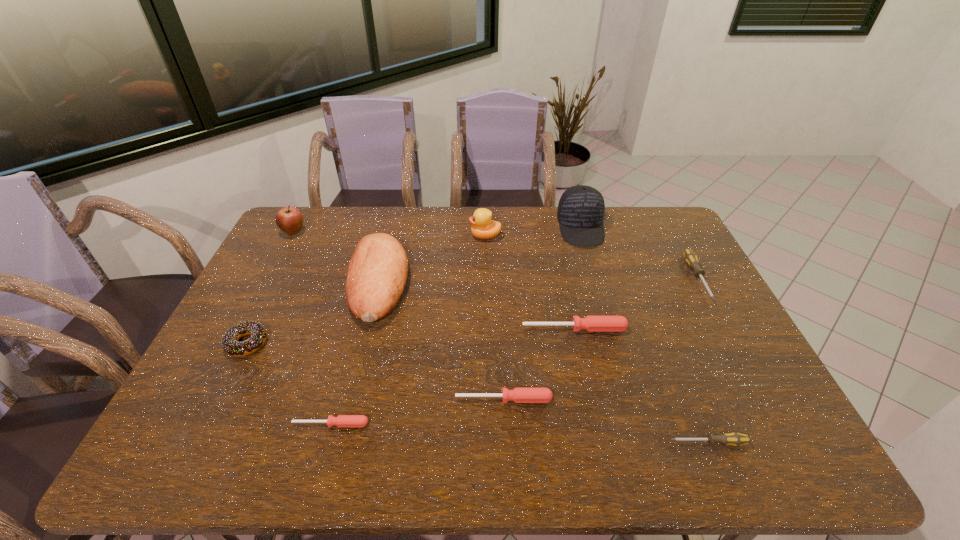
You are a GUI agent. You are given a task and a screenshot of the screen. Output one action in this format:
    pyautogui.click(x=<x>, y=<y>)
    Task: Click on the tallest object
    
    Given the screenshot: What is the action you would take?
    pyautogui.click(x=580, y=214)

The width and height of the screenshot is (960, 540). In order to click on red apple in this screenshot , I will do [289, 219].

Where is `yellow duckling`? yellow duckling is located at coordinates (483, 227).

The image size is (960, 540). What are the coordinates of `bread` in the screenshot? It's located at (377, 272).

Where is `the rightmost object`? This screenshot has width=960, height=540. the rightmost object is located at coordinates (690, 257).

At what (x,y) coordinates should I click in order to perform the action: click on the rightmost screwdriver. Please return your answer as a coordinate pair (x, y). Looking at the image, I should click on (690, 257).

Locate an element on the screen. the farthest red screwdriver is located at coordinates pyautogui.click(x=590, y=323).

At what (x,y) coordinates should I click in order to perform the action: click on the biggest red screwdriver. Please return your answer as a coordinate pair (x, y). Looking at the image, I should click on (590, 323).

Identify the location of doughnut. The image size is (960, 540). (229, 343).

Where is `the second biggest red screwdriver`? This screenshot has height=540, width=960. the second biggest red screwdriver is located at coordinates (519, 395).